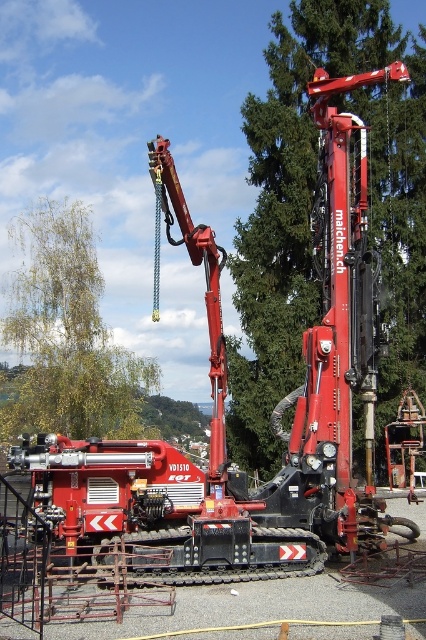
Who is shorter, green leafy tree at center or green leafy tree at upper left?

green leafy tree at upper left is shorter.

Is point (256, 218) in front of point (152, 380)?

That is True.

The height and width of the screenshot is (640, 426). Find the location of `green leafy tree at center`. green leafy tree at center is located at coordinates (310, 208).